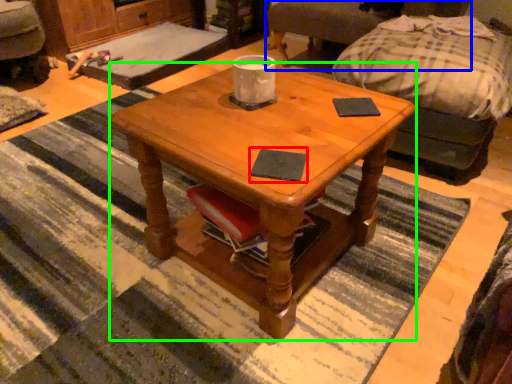
Question: Which object is the closest to the pad (highlighted by a red box)? Choose among these: swivel chair (highlighted by a blue box) or coffee table (highlighted by a green box).

Choices:
 (A) swivel chair
 (B) coffee table

Answer: (B)